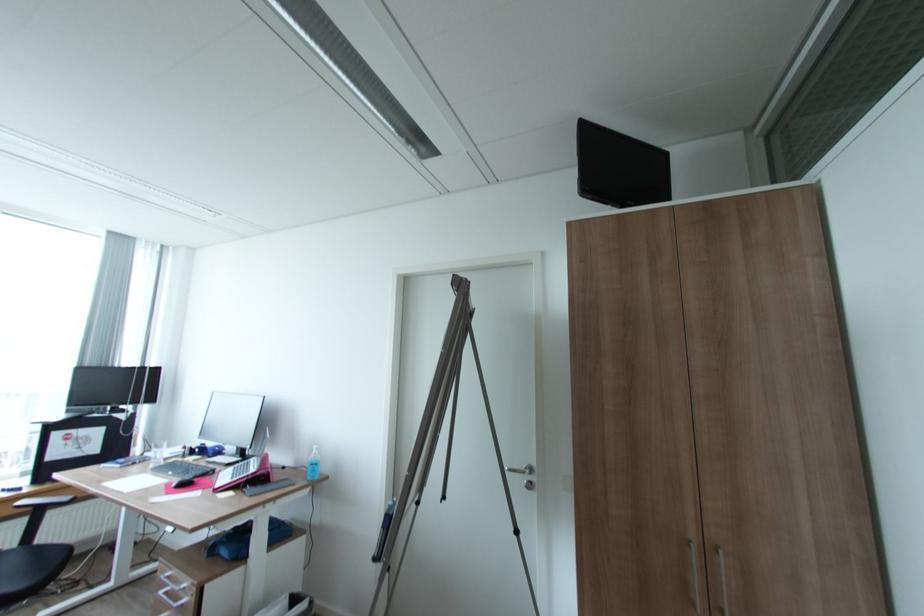
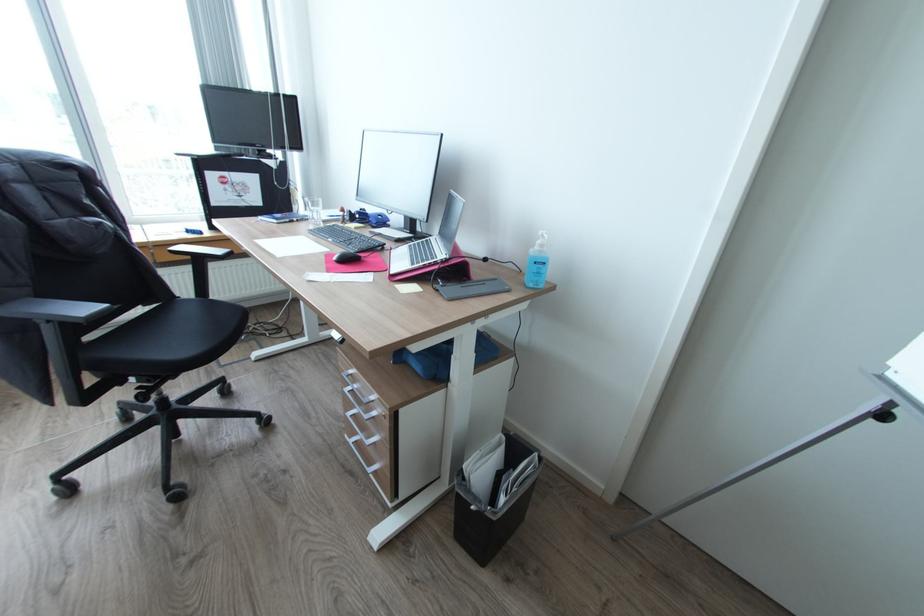
Find the pixel in the second image that matches pixel 320 454 in the first image.

(545, 245)